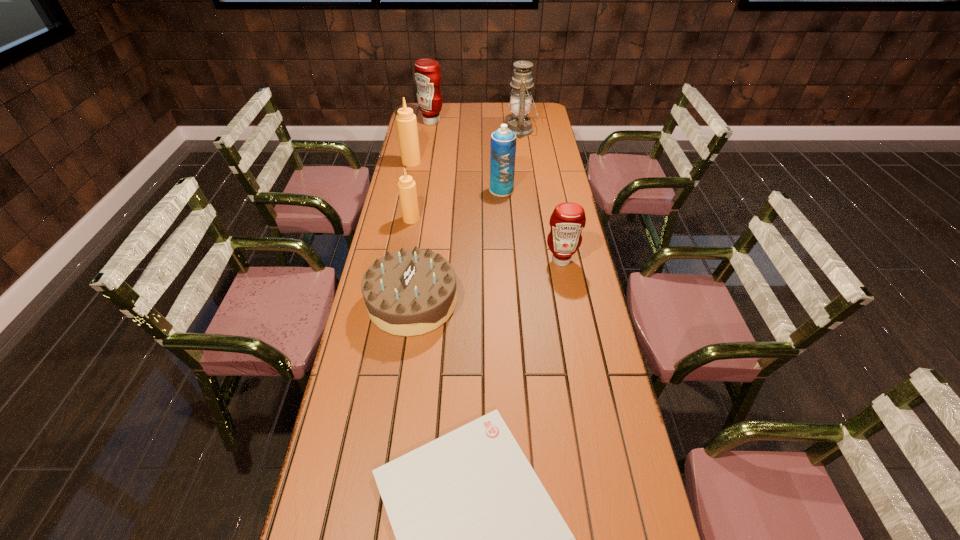
Find the location of a particular element. This screenshot has width=960, height=540. oil lamp is located at coordinates (520, 102).

Image resolution: width=960 pixels, height=540 pixels. What are the coordinates of `the second farthest condiment` in the screenshot? It's located at (406, 121).

The image size is (960, 540). Find the location of `the farther tan condiment`. the farther tan condiment is located at coordinates (406, 121).

Identify the location of the bigger red condiment. This screenshot has height=540, width=960. (427, 74).

Find the location of `the left red condiment`. the left red condiment is located at coordinates (427, 74).

This screenshot has height=540, width=960. In order to click on the fourth farthest object in this screenshot , I will do `click(503, 141)`.

The width and height of the screenshot is (960, 540). I want to click on the nearer tan condiment, so click(406, 186).

Identify the location of the smaller tan condiment. (406, 186).

You are a GUI agent. You are given a task and a screenshot of the screen. Output one action in this format:
    pyautogui.click(x=<x>, y=<y>)
    Task: Click on the smaller red condiment
    The height and width of the screenshot is (540, 960).
    Given the screenshot: What is the action you would take?
    pyautogui.click(x=568, y=219)

Locate an element on the screen. The width and height of the screenshot is (960, 540). the nearer red condiment is located at coordinates (568, 219).